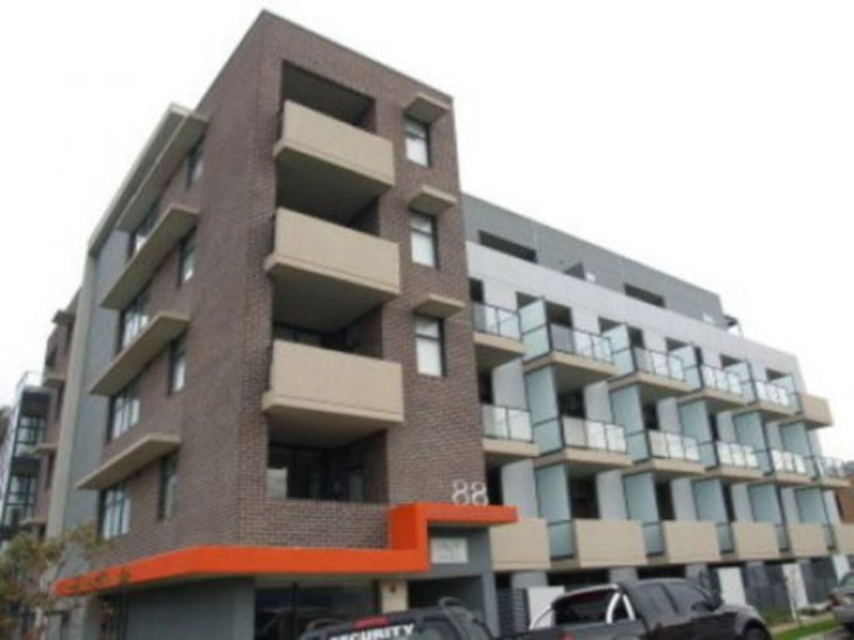
You are a delivery person trying to park a van that is 3 meters long in the space between the shiny black car at lower center and the black rubber security car at lower center. Can the van fit in that space?

The distance between the shiny black car at lower center and the black rubber security car at lower center is 3.42 meters. Since the van is 3 meters long, it can fit in the space as there is enough room.

You are a delivery person trying to park your van in the parking lot near the residential building. You see a black rubber security car at lower center and a shiny black car at lower right. Which car is blocking your path to the parking spot?

The black rubber security car at lower center is blocking your path to the parking spot because it is in front of the shiny black car at lower right.